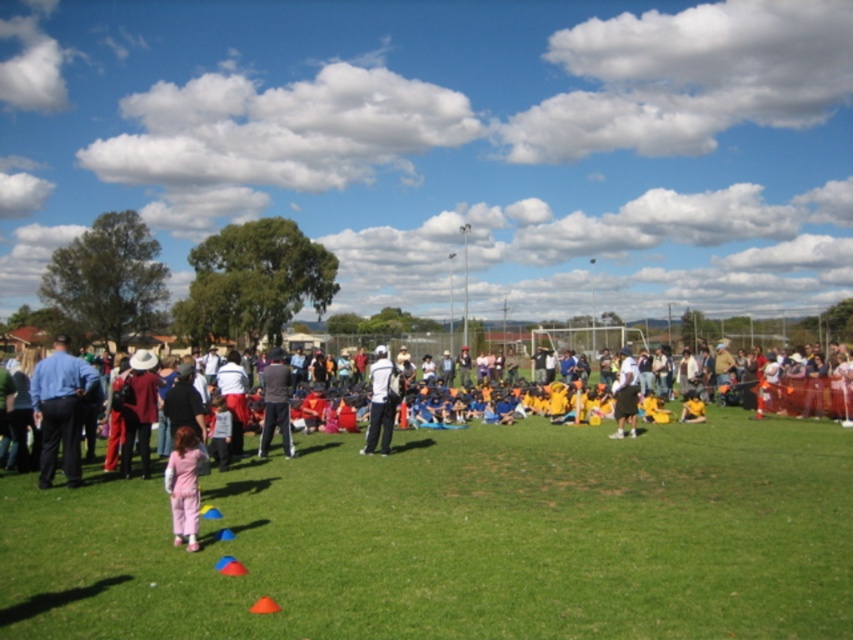
You are standing at the origin point of the image. You want to walk to the dark gray pants at center. Which direction should you walk to reach them?

You should walk towards the point at coordinates (276, 403) to reach the dark gray pants at center.

You are a photographer standing at the edge of the field. You want to capture a photo that includes both the pink fabric pants at lower left and the dark gray pants at center. Based on their positions, which object should you focus on first to ensure both are in the frame?

The pink fabric pants at lower left is positioned under the dark gray pants at center, so you should focus on the dark gray pants at center first to ensure both are in the frame.